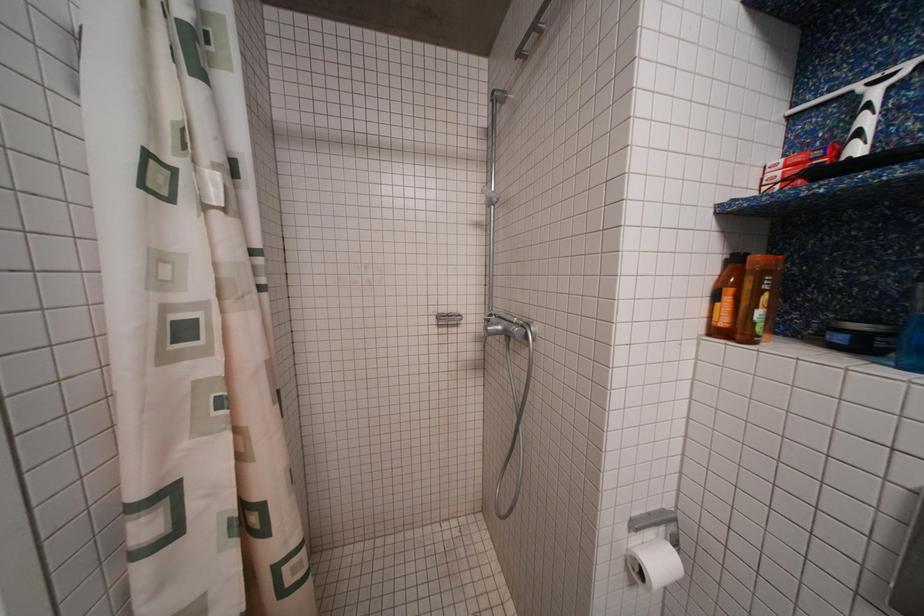
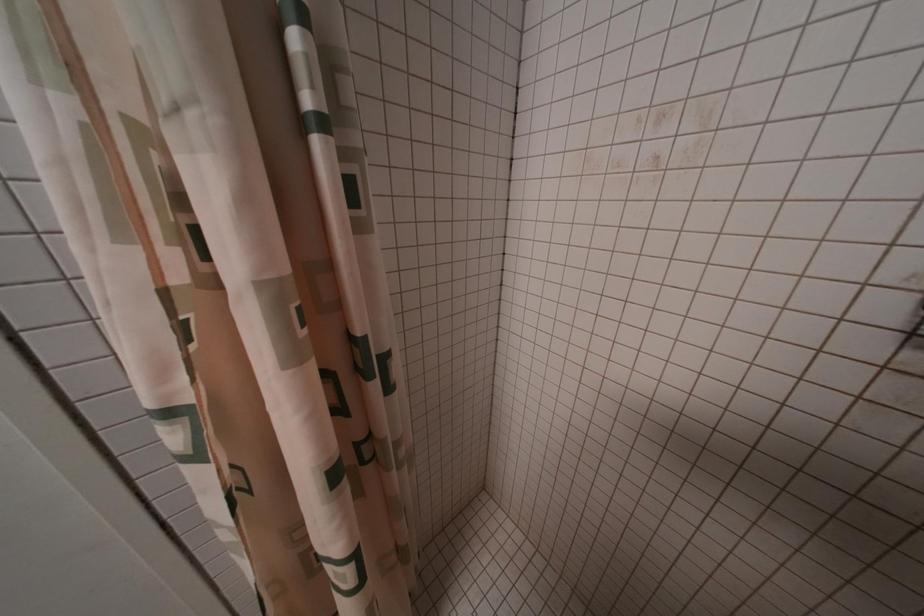
Consider the image. Based on the continuous images, in which direction is the camera rotating?

The rotation direction of the camera is left-down.